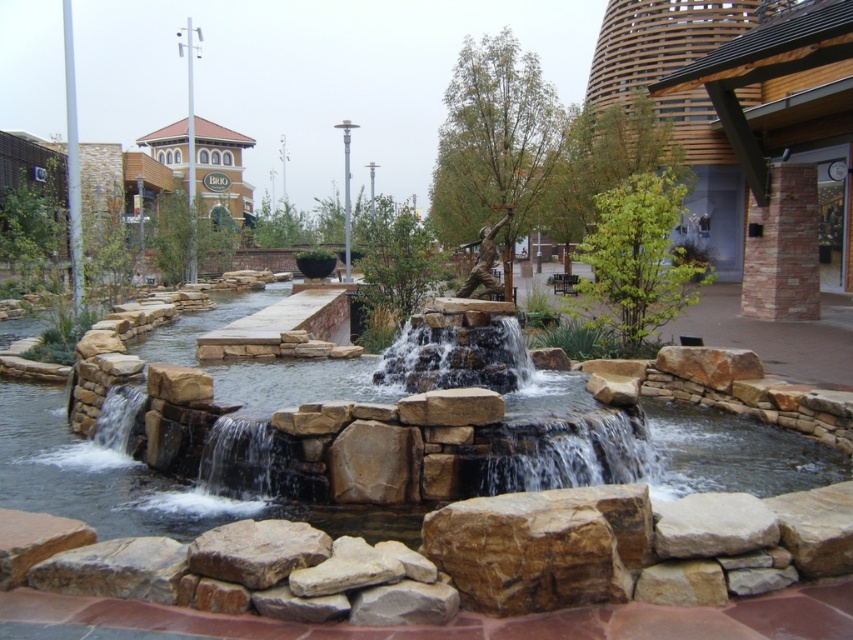
You are standing at the edge of the water feature and notice a point marked at coordinates (201, 465). Based on the scene description, can you identify what this point represents?

The point at coordinates (201, 465) corresponds to the brown stone stream at center.

You are standing at the edge of the water feature and notice both the brown stone stream at center and the brown stone waterfall at center. Which one is positioned to the left when facing the water feature?

The brown stone stream at center is positioned to the left of the brown stone waterfall at center when facing the water feature.

You are a landscape architect designing a pathway next to the water feature. You need to determine which object, the brown stone stream at center or the brown rough rock at center, has a larger width to ensure proper spacing for the pathway. Which one is wider?

The brown stone stream at center is wider than the brown rough rock at center, so the pathway should be designed around the stream to accommodate its width.